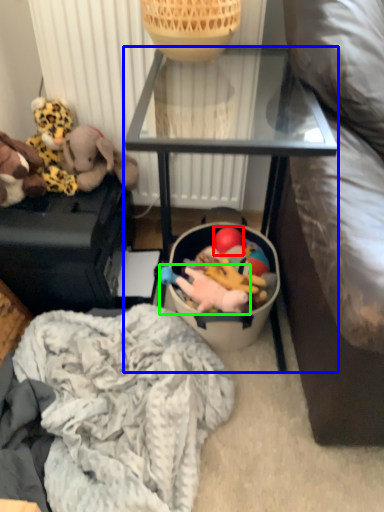
Question: Estimate the real-world distances between objects in this image. Which object is closer to toy (highlighted by a red box), furniture (highlighted by a blue box) or toy (highlighted by a green box)?

Choices:
 (A) furniture
 (B) toy

Answer: (B)